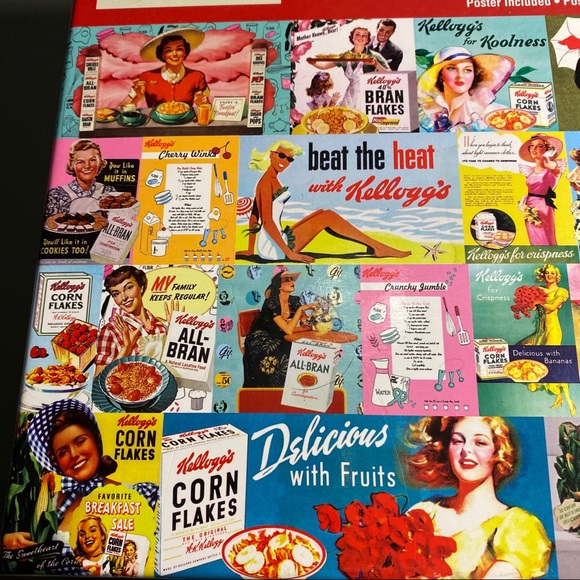
Locate an element on the screen. box of cereal is located at coordinates point(190,470), point(192,350), point(396,96), point(540,108).